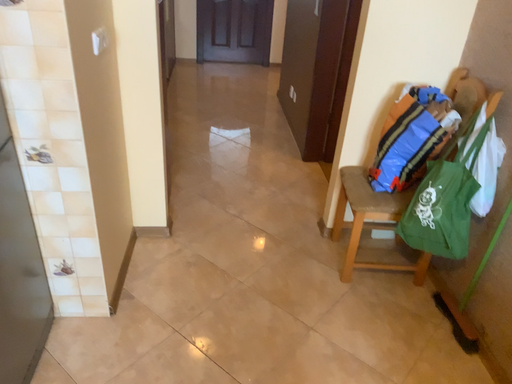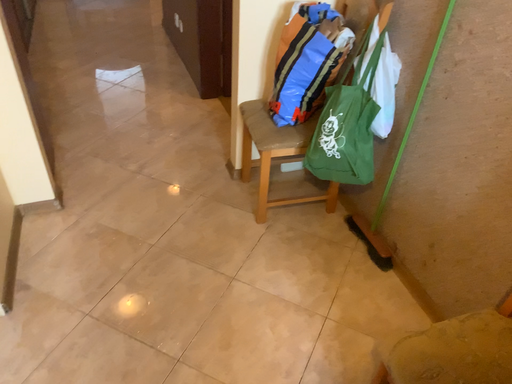
Question: Which way did the camera rotate in the video?

Choices:
 (A) rotated left
 (B) rotated right

Answer: (B)